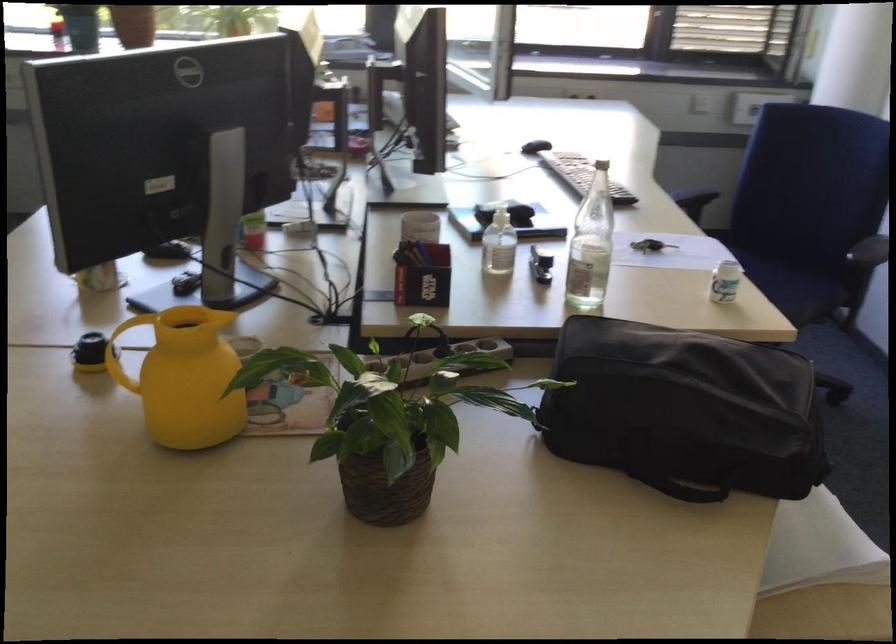
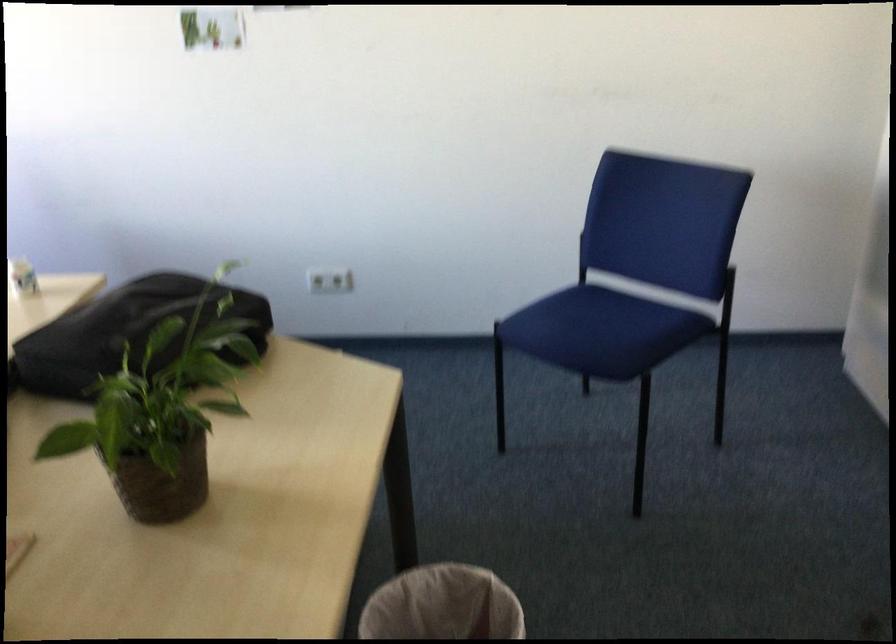
The point at (394,433) is marked in the first image. Where is the corresponding point in the second image?

(162, 413)